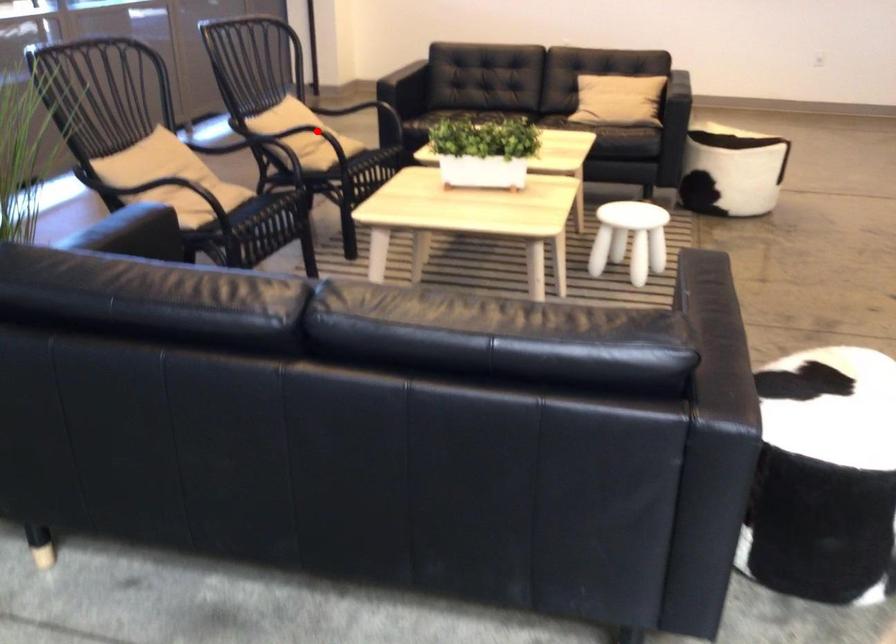
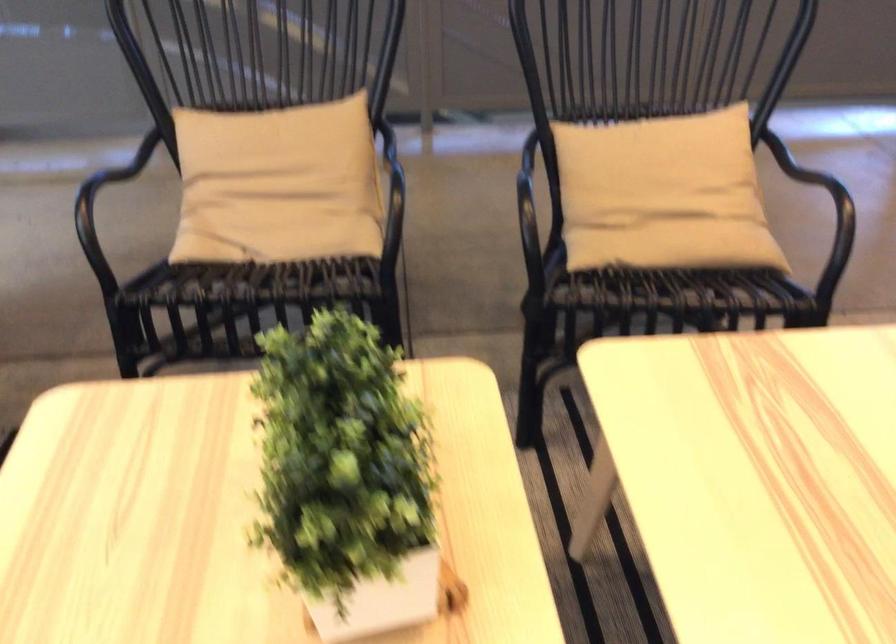
Find the pixel in the second image that matches the highlighted location in the first image.

(662, 194)